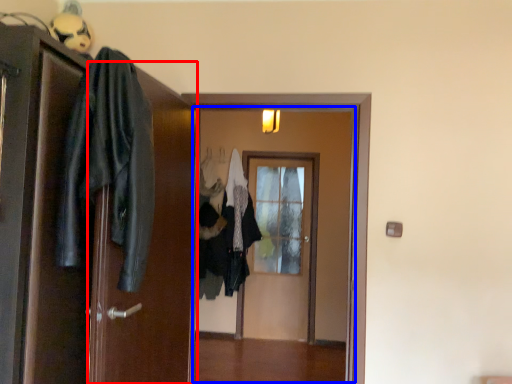
Question: Which object appears farthest to the camera in this image, screen door (highlighted by a red box) or door (highlighted by a blue box)?

Choices:
 (A) screen door
 (B) door

Answer: (B)